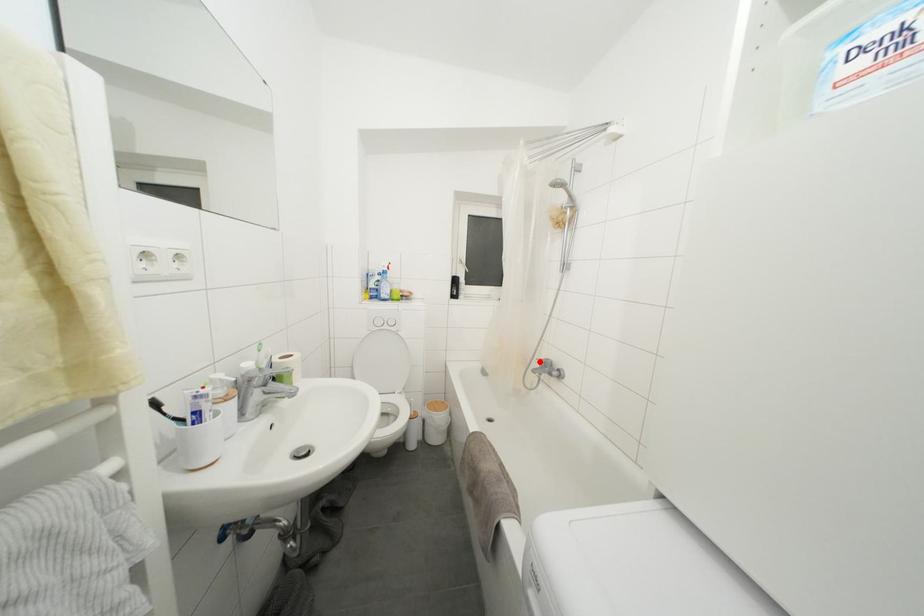
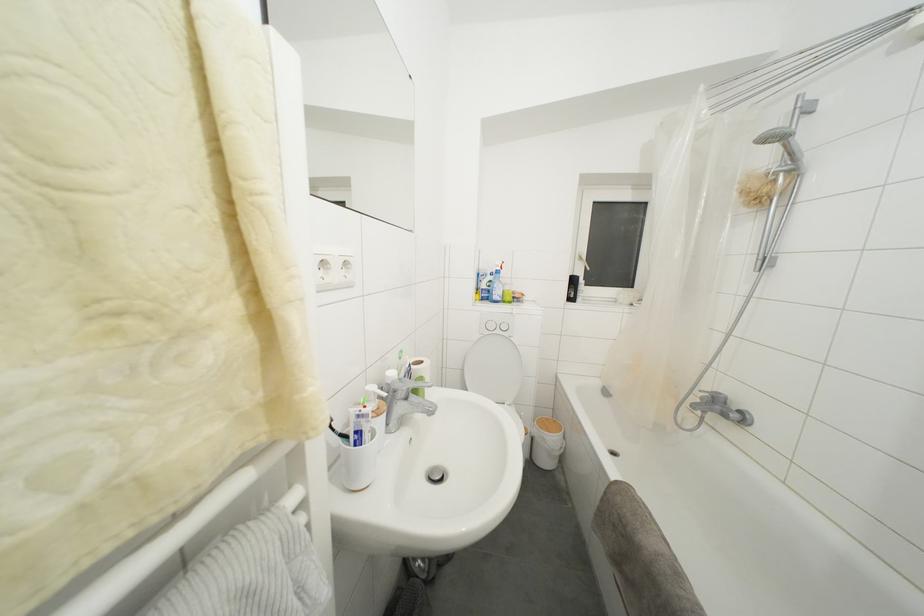
Where in the second image is the point corresponding to the highlighted location from the first image?

(703, 392)